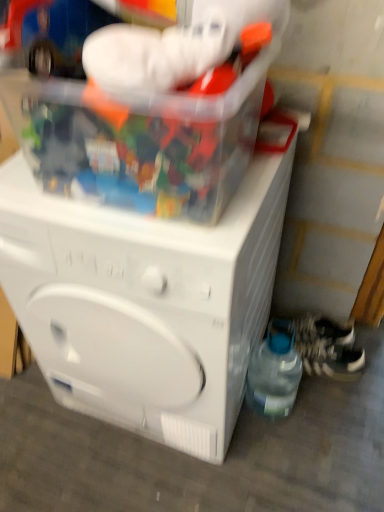
Locate an element on the screen. This screenshot has height=512, width=384. vacant space in front of white textured shoe at lower right, which appears as the second shoe when viewed from the top is located at coordinates (332, 402).